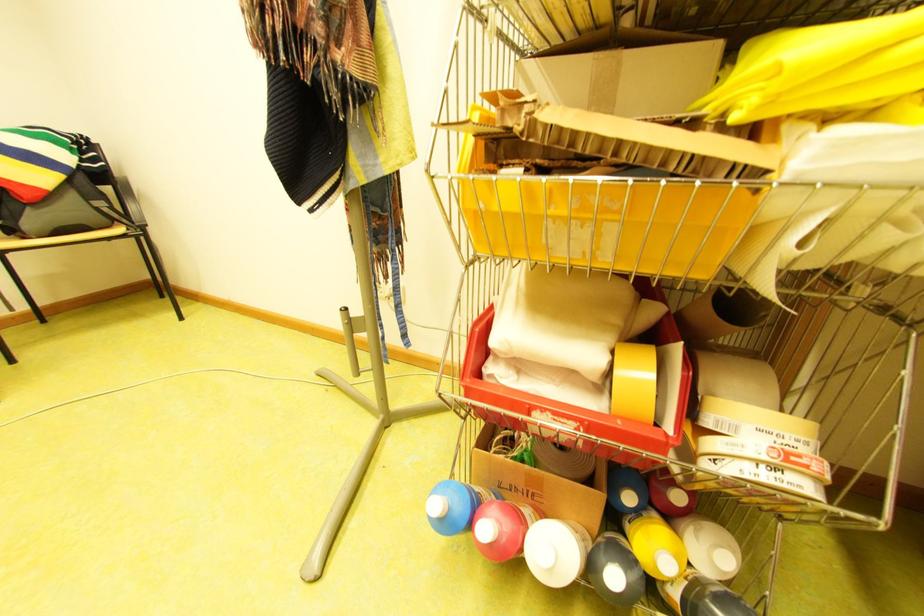
Locate an element on the screen. The height and width of the screenshot is (616, 924). yellow-capped bottle is located at coordinates (654, 544).